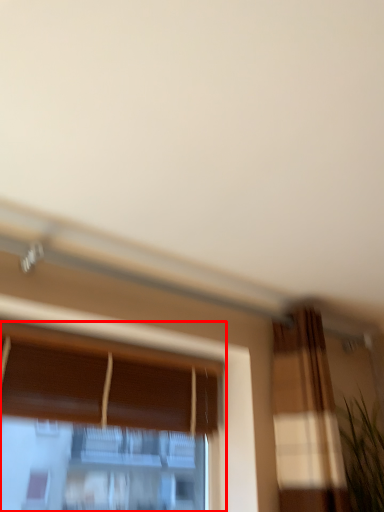
Question: From the image, what is the correct spatial relationship of window (annotated by the red box) in relation to plant?

Choices:
 (A) right
 (B) left

Answer: (B)